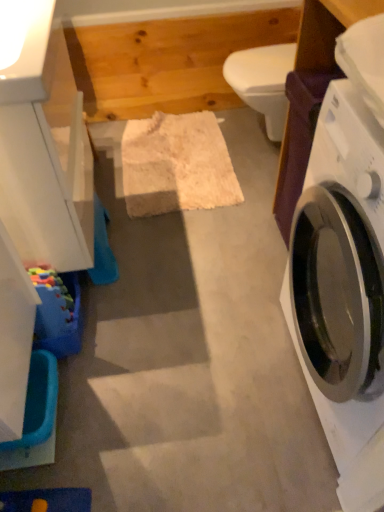
Question: From a real-world perspective, is white glossy washing machine at right above or below white glossy toilet bowl at center?

Choices:
 (A) above
 (B) below

Answer: (A)

Question: Does point (319, 397) appear closer or farther from the camera than point (276, 110)?

Choices:
 (A) farther
 (B) closer

Answer: (B)

Question: Which object is positioned farthest from the white glossy washing machine at right?

Choices:
 (A) white glossy toilet bowl at center
 (B) blue plastic tub at lower left

Answer: (B)

Question: Which of these objects is positioned farthest from the blue plastic tub at lower left?

Choices:
 (A) white glossy toilet bowl at center
 (B) white glossy washing machine at right

Answer: (A)